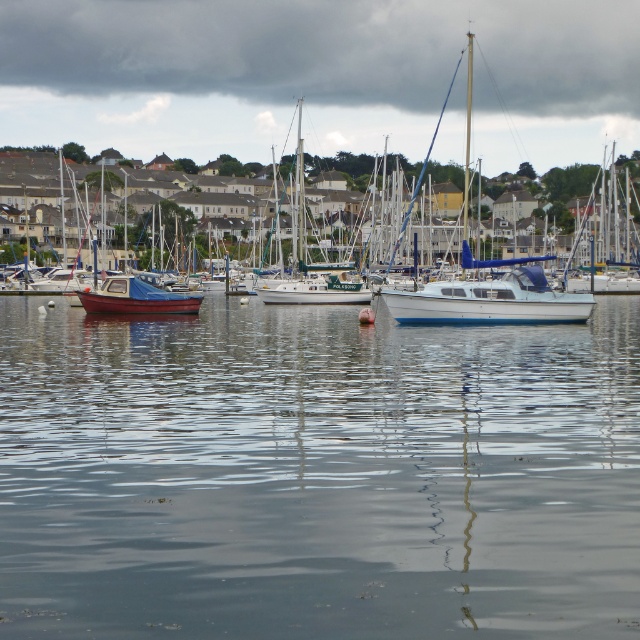
You are a photographer planning to capture the entire scene of the clear water at center and the matte blue sailboat at left in a single frame. Based on their widths, will the sailboat appear wider or narrower than the water in your photo?

The clear water at center is wider than the matte blue sailboat at left, so the sailboat will appear narrower than the water in the photo.

You are a dock worker who needs to ensure that the white glossy sailboat at center and the white glossy boat at center can fit side by side in a new docking area. Based on the scene, can both boats fit if the docking area is 15 meters wide?

The white glossy sailboat at center is wider than the white glossy boat at center. However, without knowing their exact widths or the combined width required, it is impossible to determine if they can fit in a 15 meter docking area. Additional measurements are needed.

You are a photographer planning to take a photo of the white glossy sailboat at center and the matte blue sailboat at left. Since you want both boats to be clearly visible in your shot, which boat should you focus on first to ensure proper depth of field?

You should focus on the white glossy sailboat at center first because it is positioned over the matte blue sailboat at left, meaning it is closer to you. By focusing on the closer object, the depth of field will naturally extend to the background, keeping both boats in focus.